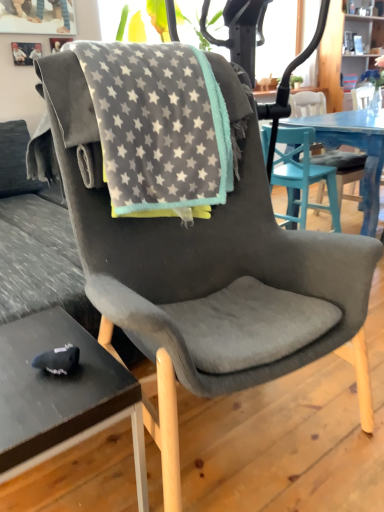
What is the approximate width of black matte desk at lower left?

black matte desk at lower left is 12.67 inches wide.

Measure the distance between point (70, 407) and camera.

33.90 inches.

Identify the location of black matte desk at lower left. (61, 396).

Are black matte desk at lower left and suede gray chair at center beside each other?

No, black matte desk at lower left is not next to suede gray chair at center.

From a real-world perspective, which object rests below the other?

black matte desk at lower left.

Considering the sizes of objects black matte desk at lower left and suede gray chair at center in the image provided, who is smaller, black matte desk at lower left or suede gray chair at center?

Smaller between the two is black matte desk at lower left.

Is point (136, 419) closer to viewer compared to point (312, 181)?

Yes, it is.

Is gray fleece blanket at center to the right of black matte desk at lower left from the viewer's perspective?

Correct, you'll find gray fleece blanket at center to the right of black matte desk at lower left.

Is black matte desk at lower left completely or partially inside gray fleece blanket at center?

No, black matte desk at lower left is not a part of gray fleece blanket at center.

In terms of height, does gray fleece blanket at center look taller or shorter compared to black matte desk at lower left?

Considering their sizes, gray fleece blanket at center has more height than black matte desk at lower left.

From the image's perspective, between gray fleece blanket at center and black matte desk at lower left, who is located below?

black matte desk at lower left, from the image's perspective.

Find the location of a particular element. desk in front of the suede gray chair at center is located at coordinates (61, 396).

Considering the sizes of suede gray chair at center and black matte desk at lower left in the image, is suede gray chair at center bigger or smaller than black matte desk at lower left?

In the image, suede gray chair at center appears to be larger than black matte desk at lower left.

Based on the photo, which is behind, suede gray chair at center or black matte desk at lower left?

suede gray chair at center is further away from the camera.

Does point (336, 191) lie in front of point (48, 337)?

That is False.

Is gray fleece blanket at center facing away from suede gray chair at center?

No, suede gray chair at center is not at the back of gray fleece blanket at center.

Is point (198, 50) closer or farther from the camera than point (283, 160)?

Point (198, 50) appears to be closer to the viewer than point (283, 160).

Between gray fleece blanket at center and suede gray chair at center, which one has smaller width?

With smaller width is suede gray chair at center.

Does gray fleece blanket at center have a greater height compared to suede gray chair at center?

Incorrect, the height of gray fleece blanket at center is not larger of that of suede gray chair at center.

What's the angular difference between black matte desk at lower left and gray fleece blanket at center's facing directions?

black matte desk at lower left and gray fleece blanket at center are facing 97 degrees away from each other.

Based on the photo, is black matte desk at lower left smaller than gray fleece blanket at center?

Indeed, black matte desk at lower left has a smaller size compared to gray fleece blanket at center.

Considering the positions of objects black matte desk at lower left and gray fleece blanket at center in the image provided, who is in front, black matte desk at lower left or gray fleece blanket at center?

black matte desk at lower left is in front.

Considering the relative sizes of black matte desk at lower left and gray fleece blanket at center in the image provided, is black matte desk at lower left taller than gray fleece blanket at center?

No, black matte desk at lower left is not taller than gray fleece blanket at center.

Looking at this image, who is taller, suede gray chair at center or gray fleece blanket at center?

suede gray chair at center.

Considering the positions of objects suede gray chair at center and gray fleece blanket at center in the image provided, who is in front, suede gray chair at center or gray fleece blanket at center?

gray fleece blanket at center is more forward.

How many degrees apart are the facing directions of suede gray chair at center and gray fleece blanket at center?

They differ by 101 degrees in their facing directions.

Identify the location of chair above the black matte desk at lower left (from a real-world perspective). This screenshot has width=384, height=512. (302, 176).

This screenshot has width=384, height=512. I want to click on beach towel behind the black matte desk at lower left, so click(x=158, y=126).

Estimate the real-world distances between objects in this image. Which object is closer to gray fleece blanket at center, suede gray chair at center or black matte desk at lower left?

black matte desk at lower left.

In the scene shown: Estimate the real-world distances between objects in this image. Which object is closer to suede gray chair at center, gray fleece blanket at center or black matte desk at lower left?

gray fleece blanket at center lies closer to suede gray chair at center than the other object.

Based on the photo, which object lies further to the anchor point suede gray chair at center, black matte desk at lower left or gray fleece blanket at center?

black matte desk at lower left is positioned further to the anchor suede gray chair at center.

Estimate the real-world distances between objects in this image. Which object is closer to black matte desk at lower left, suede gray chair at center or gray fleece blanket at center?

gray fleece blanket at center.

When comparing their distances from black matte desk at lower left, does gray fleece blanket at center or suede gray chair at center seem closer?

gray fleece blanket at center lies closer to black matte desk at lower left than the other object.

Which object lies nearer to the anchor point gray fleece blanket at center, black matte desk at lower left or suede gray chair at center?

Based on the image, black matte desk at lower left appears to be nearer to gray fleece blanket at center.

Find the location of `beach towel located between black matte desk at lower left and suede gray chair at center in the depth direction`. beach towel located between black matte desk at lower left and suede gray chair at center in the depth direction is located at coordinates (158, 126).